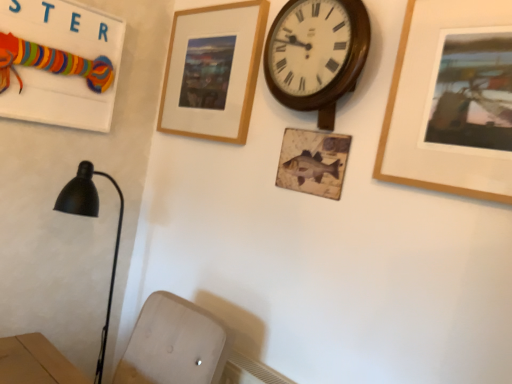
Question: Is wooden signboard at upper left directly adjacent to wooden picture frame at upper center, which appears as the first picture frame when viewed from the back?

Choices:
 (A) no
 (B) yes

Answer: (A)

Question: From a real-world perspective, is wooden signboard at upper left positioned over wooden picture frame at upper center, which is the 2th picture frame in right-to-left order, based on gravity?

Choices:
 (A) yes
 (B) no

Answer: (B)

Question: Is wooden signboard at upper left bigger than wooden picture frame at upper center, the second picture frame positioned from the front?

Choices:
 (A) yes
 (B) no

Answer: (A)

Question: Considering the relative sizes of wooden signboard at upper left and wooden picture frame at upper center, which is the 2th picture frame in right-to-left order, in the image provided, is wooden signboard at upper left shorter than wooden picture frame at upper center, which is the 2th picture frame in right-to-left order,?

Choices:
 (A) no
 (B) yes

Answer: (B)

Question: Is wooden signboard at upper left to the right of wooden picture frame at upper center, the 1th picture frame from the left, from the viewer's perspective?

Choices:
 (A) yes
 (B) no

Answer: (B)

Question: From a real-world perspective, is wooden signboard at upper left located beneath wooden picture frame at upper center, the second picture frame positioned from the front?

Choices:
 (A) no
 (B) yes

Answer: (B)

Question: Are wooden picture frame at upper right, which appears as the second picture frame when viewed from the back, and wooden signboard at upper left far apart?

Choices:
 (A) no
 (B) yes

Answer: (B)

Question: Does wooden picture frame at upper right, which is counted as the 2th picture frame, starting from the left, have a smaller size compared to wooden signboard at upper left?

Choices:
 (A) yes
 (B) no

Answer: (A)

Question: Is wooden picture frame at upper right, which is counted as the 2th picture frame, starting from the left, turned away from wooden signboard at upper left?

Choices:
 (A) yes
 (B) no

Answer: (B)

Question: Does wooden picture frame at upper right, which is counted as the 2th picture frame, starting from the left, have a greater height compared to wooden signboard at upper left?

Choices:
 (A) yes
 (B) no

Answer: (A)

Question: Is wooden picture frame at upper right, the 1th picture frame from the right, positioned in front of wooden signboard at upper left?

Choices:
 (A) no
 (B) yes

Answer: (B)

Question: From the image's perspective, is wooden picture frame at upper right, which appears as the second picture frame when viewed from the back, on wooden signboard at upper left?

Choices:
 (A) yes
 (B) no

Answer: (B)

Question: Does wooden picture frame at upper center, which is the 2th picture frame in right-to-left order, contain wooden signboard at upper left?

Choices:
 (A) no
 (B) yes

Answer: (A)